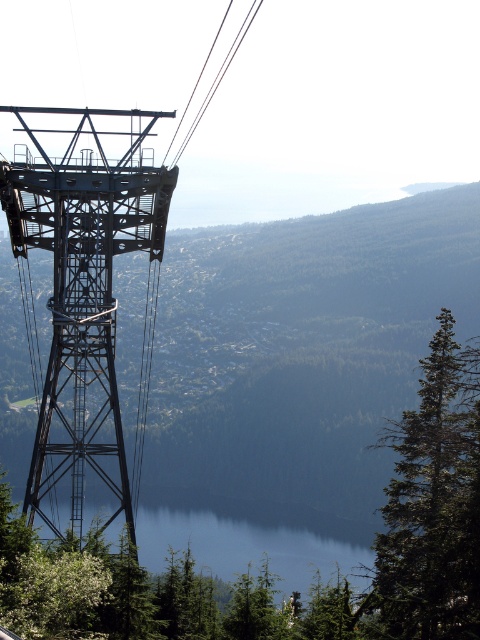
You are standing at the base of the metallic gray tower at left and want to walk to the blue glassy lake at center. Which direction should you head towards?

You should head towards the center because the blue glassy lake at center is located in that direction, while the metallic gray tower at left is closer to you.